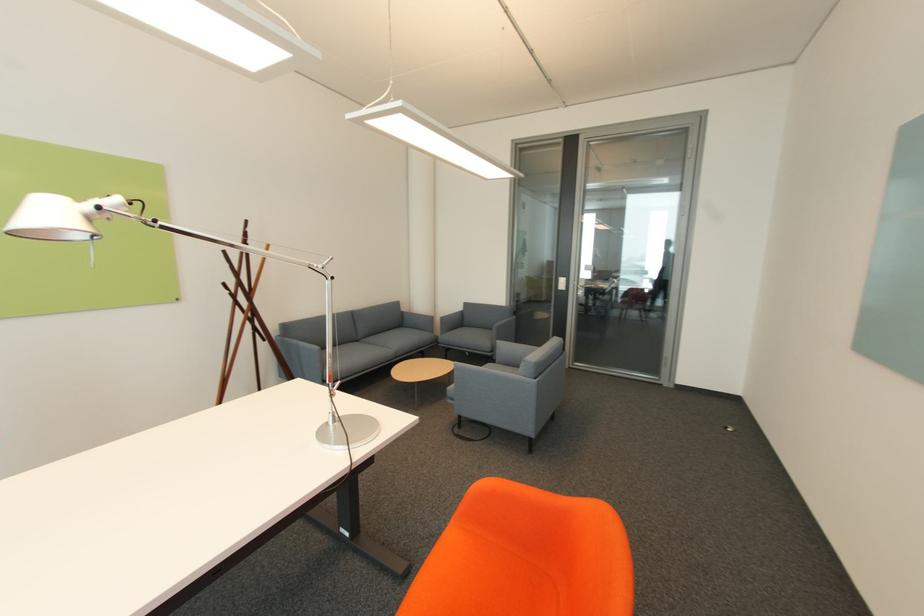
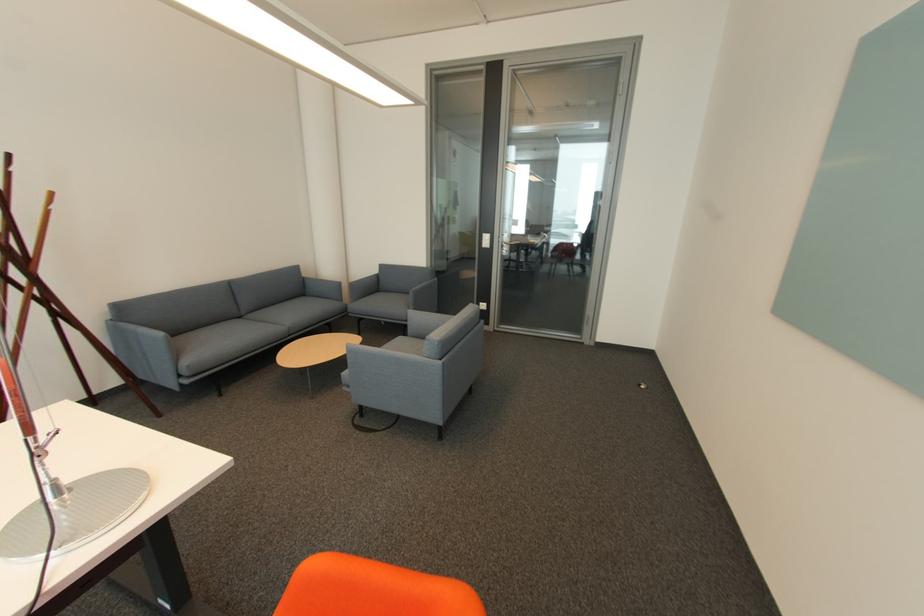
The point at (408,313) is marked in the first image. Where is the corresponding point in the second image?

(310, 278)